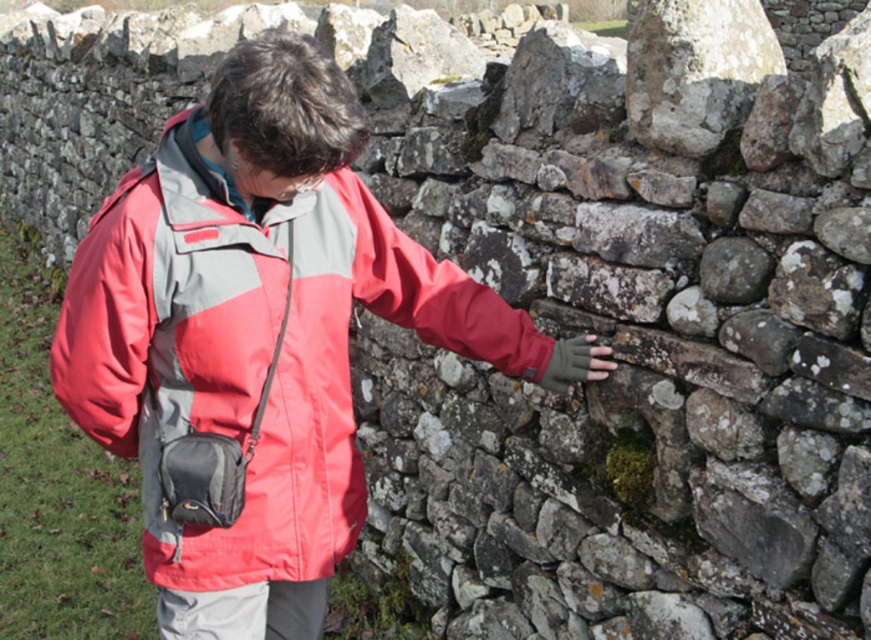
You are a photographer trying to capture the scene with the matte nylon jacket at center and the speckled stone at upper right. To ensure both are in frame, should you adjust your camera to the left or right?

The matte nylon jacket at center is to the left of the speckled stone at upper right, so you should adjust your camera to the right to ensure both are in frame.

You are a delivery person who needs to place a package on the ground between the matte nylon jacket at center and the speckled stone at upper right. The package requires a space of 1 meter. Can you fit it there?

The distance between the matte nylon jacket at center and the speckled stone at upper right is 1.13 meters, so yes, the package requiring 1 meter of space can fit between them.

You are a photographer trying to capture the person in the matte nylon jacket at center and the speckled stone at upper right in the same frame. Which object is positioned closer to the camera?

The matte nylon jacket at center is closer to the viewer than the speckled stone at upper right, so it is positioned closer to the camera.